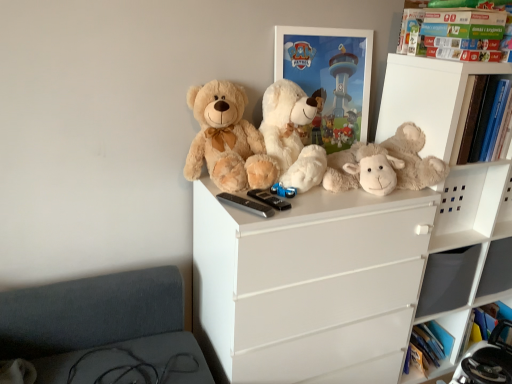
Question: Which direction should I rotate to look at fluffy white teddy bear at upper center, the 2th teddy bear positioned from the right, — up or down?

Choices:
 (A) up
 (B) down

Answer: (A)

Question: Is fluffy beige teddy bear at center, marked as the 3th teddy bear in a left-to-right arrangement, a part of fluffy beige teddy bear at upper center, which appears as the first teddy bear when viewed from the left?

Choices:
 (A) no
 (B) yes

Answer: (A)

Question: From the image's perspective, would you say fluffy beige teddy bear at upper center, the 3th teddy bear from the right, is positioned over fluffy beige teddy bear at center, marked as the 3th teddy bear in a left-to-right arrangement?

Choices:
 (A) yes
 (B) no

Answer: (A)

Question: Does fluffy beige teddy bear at upper center, which appears as the first teddy bear when viewed from the left, have a lesser width compared to fluffy beige teddy bear at center, placed as the 1th teddy bear when sorted from right to left?

Choices:
 (A) yes
 (B) no

Answer: (A)

Question: From a real-world perspective, does fluffy beige teddy bear at upper center, the 3th teddy bear from the right, sit lower than fluffy beige teddy bear at center, placed as the 1th teddy bear when sorted from right to left?

Choices:
 (A) yes
 (B) no

Answer: (B)

Question: Considering the relative sizes of fluffy beige teddy bear at upper center, which appears as the first teddy bear when viewed from the left, and fluffy beige teddy bear at center, placed as the 1th teddy bear when sorted from right to left, in the image provided, is fluffy beige teddy bear at upper center, which appears as the first teddy bear when viewed from the left, taller than fluffy beige teddy bear at center, placed as the 1th teddy bear when sorted from right to left,?

Choices:
 (A) no
 (B) yes

Answer: (B)

Question: From the image's perspective, is fluffy beige teddy bear at upper center, which appears as the first teddy bear when viewed from the left, below fluffy beige teddy bear at center, placed as the 1th teddy bear when sorted from right to left?

Choices:
 (A) yes
 (B) no

Answer: (B)

Question: Can you confirm if fluffy beige teddy bear at center, marked as the 3th teddy bear in a left-to-right arrangement, is smaller than fluffy beige teddy bear at upper center, the 3th teddy bear from the right?

Choices:
 (A) no
 (B) yes

Answer: (A)

Question: Is fluffy beige teddy bear at center, placed as the 1th teddy bear when sorted from right to left, located outside fluffy beige teddy bear at upper center, which appears as the first teddy bear when viewed from the left?

Choices:
 (A) yes
 (B) no

Answer: (A)

Question: Is the depth of fluffy beige teddy bear at center, marked as the 3th teddy bear in a left-to-right arrangement, greater than that of fluffy beige teddy bear at upper center, the 3th teddy bear from the right?

Choices:
 (A) yes
 (B) no

Answer: (A)

Question: Does fluffy beige teddy bear at center, placed as the 1th teddy bear when sorted from right to left, appear on the right side of fluffy beige teddy bear at upper center, which appears as the first teddy bear when viewed from the left?

Choices:
 (A) yes
 (B) no

Answer: (A)

Question: Is fluffy beige teddy bear at center, placed as the 1th teddy bear when sorted from right to left, to the left of fluffy beige teddy bear at upper center, the 3th teddy bear from the right, from the viewer's perspective?

Choices:
 (A) no
 (B) yes

Answer: (A)

Question: From the image's perspective, is fluffy beige teddy bear at center, placed as the 1th teddy bear when sorted from right to left, above fluffy beige teddy bear at upper center, which appears as the first teddy bear when viewed from the left?

Choices:
 (A) no
 (B) yes

Answer: (A)

Question: Can you confirm if white glossy picture frame at upper center is bigger than fluffy white teddy bear at upper center, which is the second teddy bear in left-to-right order?

Choices:
 (A) no
 (B) yes

Answer: (A)